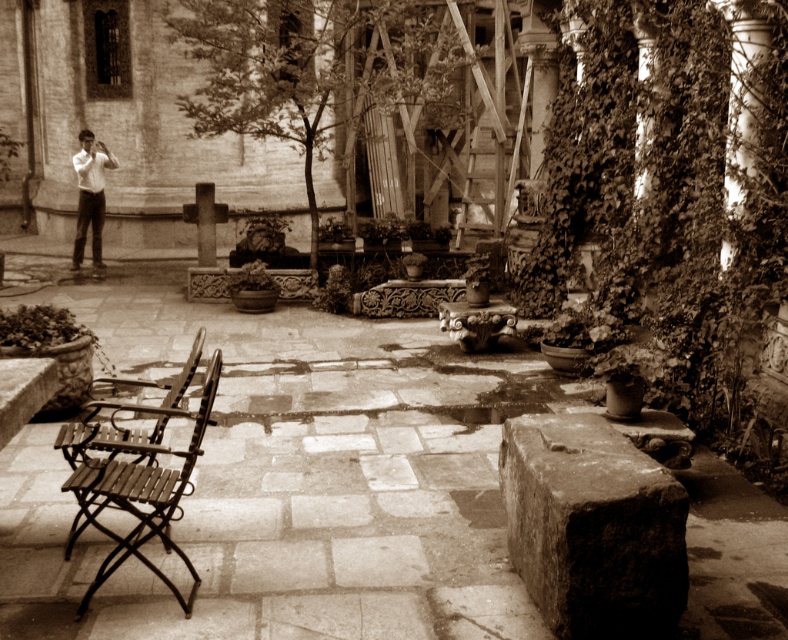
You are standing in the courtyard and want to take a photo of the white shirt at left without the metallic brown chair at lower left blocking the view. How should you position yourself to achieve this?

Move behind the metallic brown chair at lower left so that the white shirt at left is visible without obstruction.

You are designing a new courtyard and want to place a bench between the metallic brown chair at lower left and the white smooth column at right. Considering their sizes, which object should the bench be closer to to ensure it doesn

The metallic brown chair at lower left is wider than the white smooth column at right, so the bench should be placed closer to the white smooth column at right to accommodate the chair